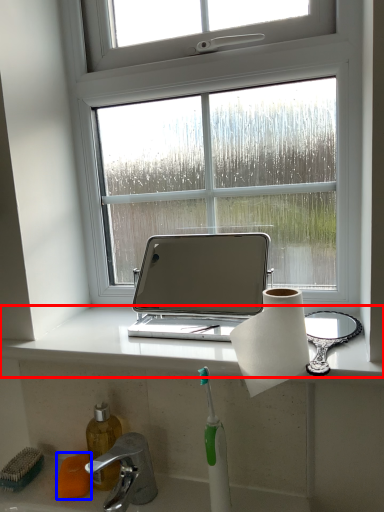
Question: Which object appears closest to the camera in this image, window sill (highlighted by a red box) or soap (highlighted by a blue box)?

Choices:
 (A) window sill
 (B) soap

Answer: (A)